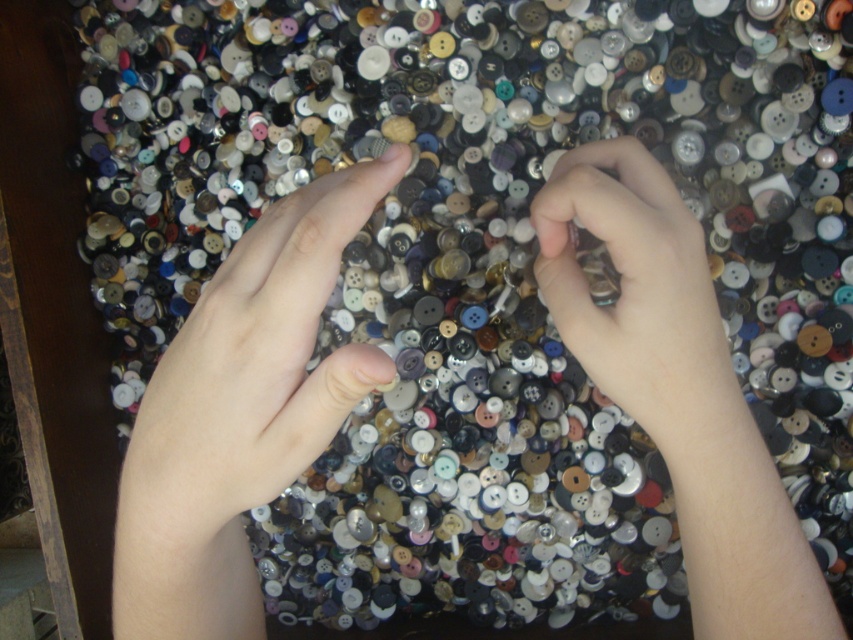
You are a tailor trying to find a specific button in the pile. You notice a point at coordinate (x=239, y=413). What is located at that point?

The point at coordinate (x=239, y=413) corresponds to smooth skin hands at center.

You are an artist observing the scene of two hands interacting with buttons. Which object in the image has a greater height measurement between the smooth skin hands at center and the pale skin at center?

The smooth skin hands at center is much taller than the pale skin at center according to the description provided.